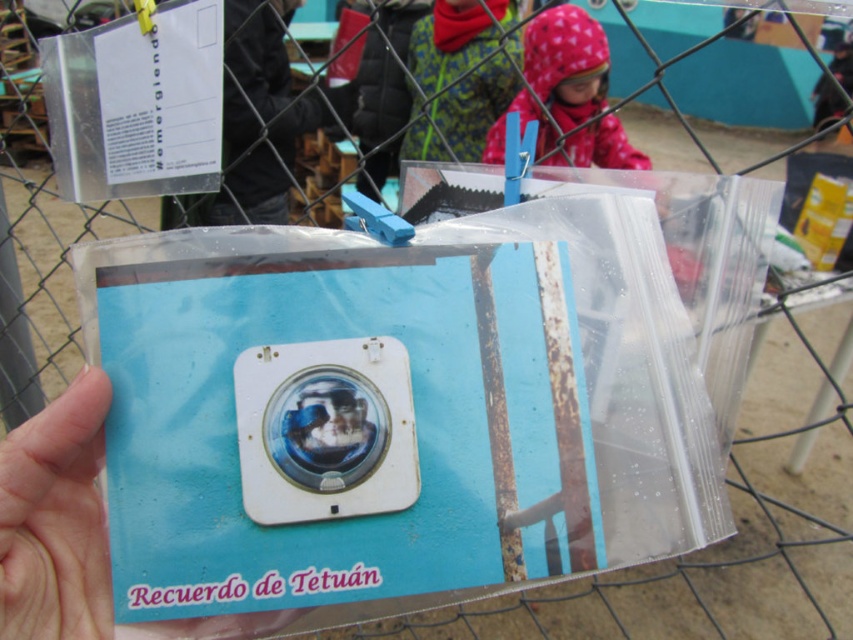
Question: Is the position of white plastic camera at center less distant than that of matte plastic hand at lower left?

Choices:
 (A) no
 (B) yes

Answer: (A)

Question: Which of the following is the closest to the observer?

Choices:
 (A) fluffy pink hood at upper center
 (B) matte plastic hand at lower left

Answer: (B)

Question: Which of these objects is positioned farthest from the white plastic camera at center?

Choices:
 (A) matte plastic hand at lower left
 (B) fluffy pink hood at upper center

Answer: (B)

Question: Which point is closer to the camera?

Choices:
 (A) [338, 413]
 (B) [540, 81]

Answer: (A)

Question: Is matte plastic hand at lower left closer to camera compared to fluffy pink hood at upper center?

Choices:
 (A) no
 (B) yes

Answer: (B)

Question: Is matte plastic hand at lower left closer to the viewer compared to fluffy pink hood at upper center?

Choices:
 (A) no
 (B) yes

Answer: (B)